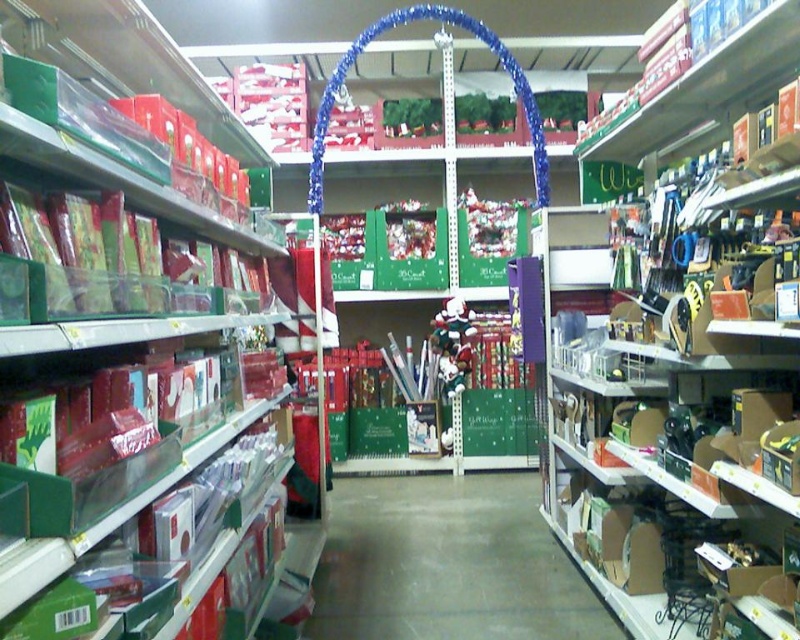
Between cardboard boxes at right and matte red gift wrap at left, which one has less height?

Standing shorter between the two is matte red gift wrap at left.

Does point (662, 620) lie behind point (260, 150)?

No, (662, 620) is in front of (260, 150).

The height and width of the screenshot is (640, 800). In order to click on cardboard boxes at right in this screenshot , I will do point(678,410).

Is concrete floor at center smaller than shiny metallic santa at center?

Actually, concrete floor at center might be larger than shiny metallic santa at center.

This screenshot has width=800, height=640. What do you see at coordinates (448, 564) in the screenshot? I see `concrete floor at center` at bounding box center [448, 564].

Is point (486, 605) more distant than point (470, 360)?

No.

You are a GUI agent. You are given a task and a screenshot of the screen. Output one action in this format:
    pyautogui.click(x=<x>, y=<y>)
    Task: Click on the concrete floor at center
    Image resolution: width=800 pixels, height=640 pixels.
    Given the screenshot: What is the action you would take?
    pyautogui.click(x=448, y=564)

Does point (408, 515) come farther from viewer compared to point (48, 3)?

Yes.

Where is `concrete floor at center`? This screenshot has height=640, width=800. concrete floor at center is located at coordinates (448, 564).

What do you see at coordinates (448, 564) in the screenshot? I see `concrete floor at center` at bounding box center [448, 564].

Find the location of a particular element. concrete floor at center is located at coordinates (448, 564).